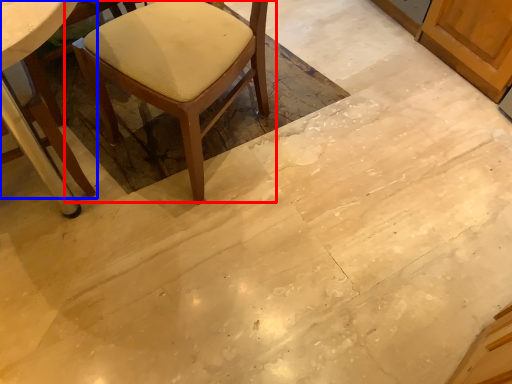
Question: Which object is further to the camera taking this photo, chair (highlighted by a red box) or chair (highlighted by a blue box)?

Choices:
 (A) chair
 (B) chair

Answer: (A)